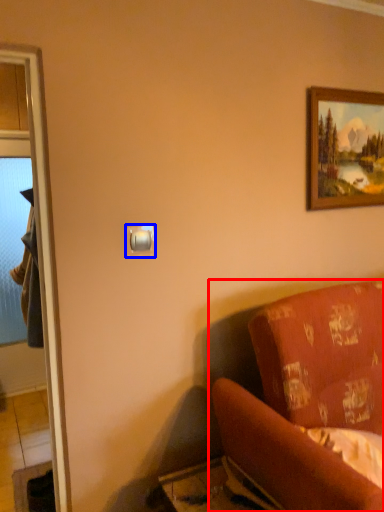
Question: Which object is further to the camera taking this photo, studio couch (highlighted by a red box) or light switch (highlighted by a blue box)?

Choices:
 (A) studio couch
 (B) light switch

Answer: (B)